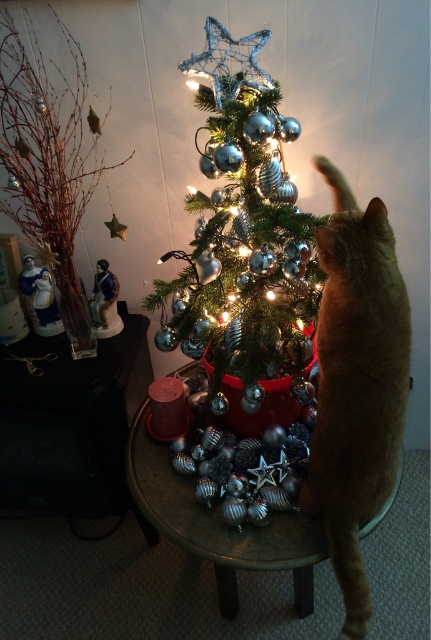
Can you confirm if orange fur cat at right is positioned below metallic silver table at center?

Incorrect, orange fur cat at right is not positioned below metallic silver table at center.

Can you confirm if orange fur cat at right is shorter than metallic silver table at center?

In fact, orange fur cat at right may be taller than metallic silver table at center.

Between point (321, 500) and point (162, 458), which one is positioned behind?

Point (162, 458)

Locate an element on the screen. The image size is (431, 640). orange fur cat at right is located at coordinates (356, 384).

From the picture: Which is more to the right, shiny metallic tree at center or silver metallic ornaments at left?

shiny metallic tree at center is more to the right.

Is point (283, 227) in front of point (68, 35)?

Yes, it is in front of point (68, 35).

Identify the location of shiny metallic tree at center. (243, 241).

Measure the distance between shiny metallic tree at center and orange fur cat at right.

They are 8.02 inches apart.

Does shiny metallic tree at center lie in front of orange fur cat at right?

No, it is behind orange fur cat at right.

Is point (243, 195) closer to viewer compared to point (356, 337)?

No, (243, 195) is behind (356, 337).

Find the location of a particular element. shiny metallic tree at center is located at coordinates (243, 241).